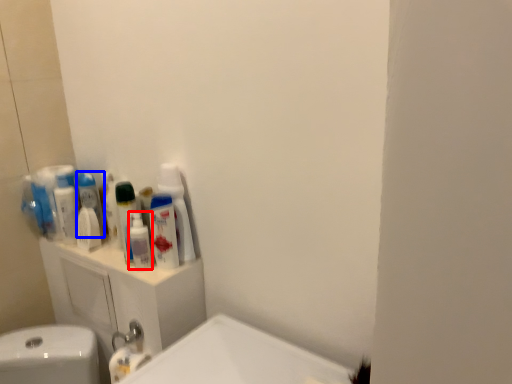
Question: Which object appears closest to the camera in this image, mouthwash (highlighted by a red box) or mouthwash (highlighted by a blue box)?

Choices:
 (A) mouthwash
 (B) mouthwash

Answer: (A)